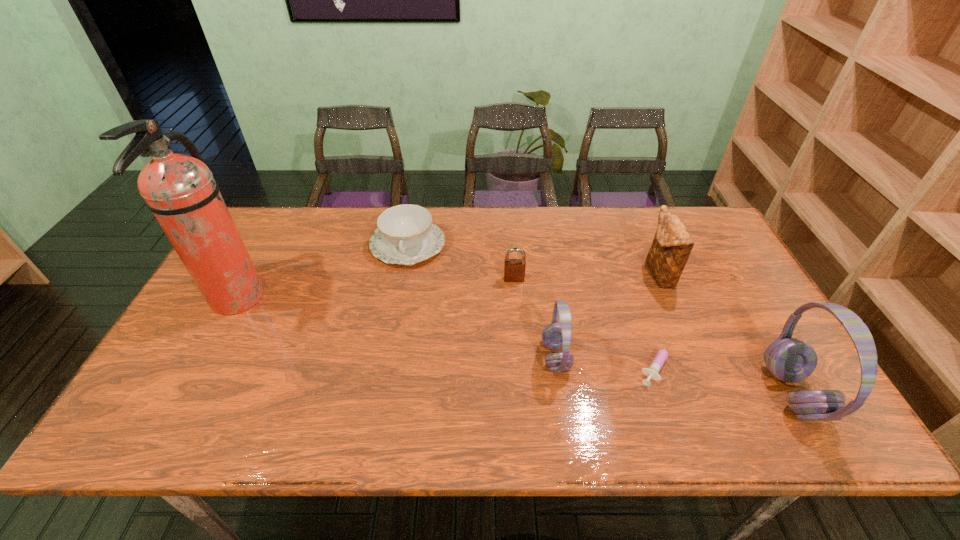
Please point a spot to add another headset on the left. Please provide its 2D coordinates. Your answer should be formatted as a tuple, i.e. [(x, y)], where the tuple contains the x and y coordinates of a point satisfying the conditions above.

[(349, 326)]